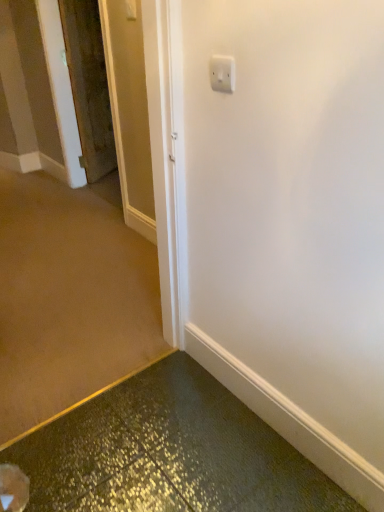
Question: Choose the correct answer: Is wooden door at left inside white plastic light switch at upper center or outside it?

Choices:
 (A) outside
 (B) inside

Answer: (A)

Question: From a real-world perspective, is wooden door at left positioned above or below white plastic light switch at upper center?

Choices:
 (A) above
 (B) below

Answer: (B)

Question: From the image's perspective, is wooden door at left located above or below white plastic light switch at upper center?

Choices:
 (A) above
 (B) below

Answer: (A)

Question: Considering the positions of point (221, 60) and point (100, 116), is point (221, 60) closer or farther from the camera than point (100, 116)?

Choices:
 (A) farther
 (B) closer

Answer: (B)

Question: Would you say white plastic light switch at upper center is inside or outside wooden door at left?

Choices:
 (A) inside
 (B) outside

Answer: (B)

Question: From the image's perspective, is white plastic light switch at upper center located above or below wooden door at left?

Choices:
 (A) below
 (B) above

Answer: (A)

Question: Considering the positions of white plastic light switch at upper center and wooden door at left in the image, is white plastic light switch at upper center bigger or smaller than wooden door at left?

Choices:
 (A) big
 (B) small

Answer: (B)